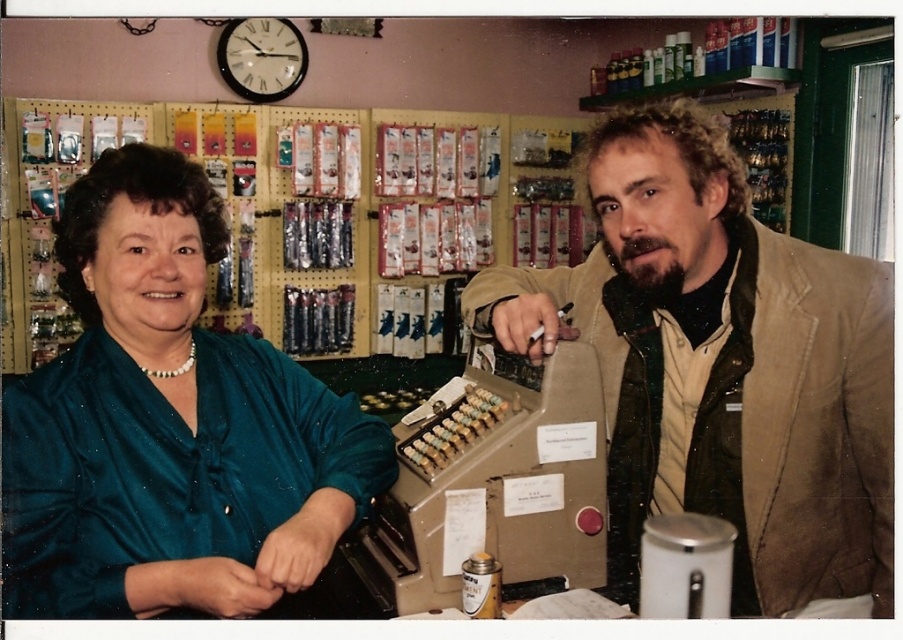
You are a customer in the store and want to hang a new coat on the rack. The coat is 1.2 meters tall. Can the brown leather jacket at right and the green satin blouse at left fit on the rack if the rack has a maximum height limit of 1.5 meters?

The brown leather jacket at right is much taller than the green satin blouse at left. Since the rack has a maximum height limit of 1.5 meters and the coat is 1.2 meters tall, both items can fit on the rack as their heights are below the limit.

In the scene shown: You are a customer in the store and want to buy a jacket that can comfortably fit over your winter coat. The store has a brown leather jacket at right and a green satin blouse at left. Based on their sizes, which one is more likely to be suitable for your needs?

The brown leather jacket at right has a larger size compared to the green satin blouse at left, making it more suitable for fitting over a winter coat.